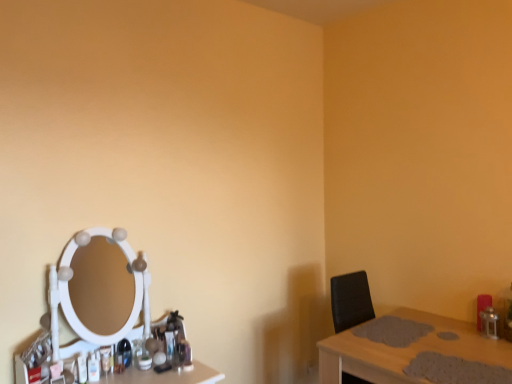
The image size is (512, 384). Describe the element at coordinates (405, 350) in the screenshot. I see `wooden table at right` at that location.

This screenshot has height=384, width=512. I want to click on wooden table at right, so click(405, 350).

This screenshot has width=512, height=384. Describe the element at coordinates (95, 296) in the screenshot. I see `white glossy makeup mirror at left` at that location.

Where is `white glossy makeup mirror at left`? The height and width of the screenshot is (384, 512). white glossy makeup mirror at left is located at coordinates (95, 296).

Locate an element on the screen. Image resolution: width=512 pixels, height=384 pixels. wooden table at right is located at coordinates (405, 350).

Between wooden table at right and white glossy makeup mirror at left, which one appears on the left side from the viewer's perspective?

white glossy makeup mirror at left.

Considering their positions, is wooden table at right located in front of or behind white glossy makeup mirror at left?

In the image, wooden table at right appears in front of white glossy makeup mirror at left.

Between point (474, 328) and point (102, 278), which one is positioned in front?

Positioned in front is point (102, 278).

From the image's perspective, which object appears higher, wooden table at right or white glossy makeup mirror at left?

From the image's view, white glossy makeup mirror at left is above.

From a real-world perspective, who is located lower, wooden table at right or white glossy makeup mirror at left?

wooden table at right is physically lower.

Considering the sizes of objects wooden table at right and white glossy makeup mirror at left in the image provided, who is wider, wooden table at right or white glossy makeup mirror at left?

wooden table at right.

Can you confirm if wooden table at right is taller than white glossy makeup mirror at left?

No, wooden table at right is not taller than white glossy makeup mirror at left.

Can you confirm if wooden table at right is smaller than white glossy makeup mirror at left?

Incorrect, wooden table at right is not smaller in size than white glossy makeup mirror at left.

Looking at this image, is white glossy makeup mirror at left surrounded by wooden table at right?

No, white glossy makeup mirror at left is not a part of wooden table at right.

Is the surface of wooden table at right in direct contact with white glossy makeup mirror at left?

wooden table at right is not next to white glossy makeup mirror at left, and they're not touching.

Does wooden table at right turn towards white glossy makeup mirror at left?

No, wooden table at right is not turned towards white glossy makeup mirror at left.

How different are the orientations of wooden table at right and white glossy makeup mirror at left in degrees?

The angular difference between wooden table at right and white glossy makeup mirror at left is 90.8 degrees.

Where is `computer desk above the wooden table at right (from the image's perspective)`? The image size is (512, 384). computer desk above the wooden table at right (from the image's perspective) is located at coordinates (95, 296).

Would you say white glossy makeup mirror at left is to the left or to the right of wooden table at right in the picture?

white glossy makeup mirror at left is positioned on wooden table at right's left side.

Considering the relative positions of white glossy makeup mirror at left and wooden table at right in the image provided, is white glossy makeup mirror at left behind wooden table at right?

Yes, white glossy makeup mirror at left is further from the viewer.

Considering the points (63, 353) and (372, 358), which point is behind, point (63, 353) or point (372, 358)?

The point (372, 358) is farther.

From the image's perspective, which object appears higher, white glossy makeup mirror at left or wooden table at right?

From the image's view, white glossy makeup mirror at left is above.

From a real-world perspective, relative to wooden table at right, is white glossy makeup mirror at left vertically above or below?

white glossy makeup mirror at left is above wooden table at right.

Is white glossy makeup mirror at left thinner than wooden table at right?

Indeed, white glossy makeup mirror at left has a lesser width compared to wooden table at right.

Considering the relative sizes of white glossy makeup mirror at left and wooden table at right in the image provided, is white glossy makeup mirror at left shorter than wooden table at right?

No, white glossy makeup mirror at left is not shorter than wooden table at right.

Who is smaller, white glossy makeup mirror at left or wooden table at right?

With smaller size is white glossy makeup mirror at left.

Do you think white glossy makeup mirror at left is within wooden table at right, or outside of it?

white glossy makeup mirror at left is spatially situated outside wooden table at right.

Is white glossy makeup mirror at left positioned far away from wooden table at right?

Yes.

Is white glossy makeup mirror at left facing away from wooden table at right?

That's not correct — white glossy makeup mirror at left is not looking away from wooden table at right.

What's the angular difference between white glossy makeup mirror at left and wooden table at right's facing directions?

They differ by 90.8 degrees in their facing directions.

Locate an element on the screen. computer desk located behind the wooden table at right is located at coordinates (95, 296).

At what (x,y) coordinates should I click in order to perform the action: click on computer desk above the wooden table at right (from the image's perspective). Please return your answer as a coordinate pair (x, y). Looking at the image, I should click on (95, 296).

Find the location of `table on the right of white glossy makeup mirror at left`. table on the right of white glossy makeup mirror at left is located at coordinates (405, 350).